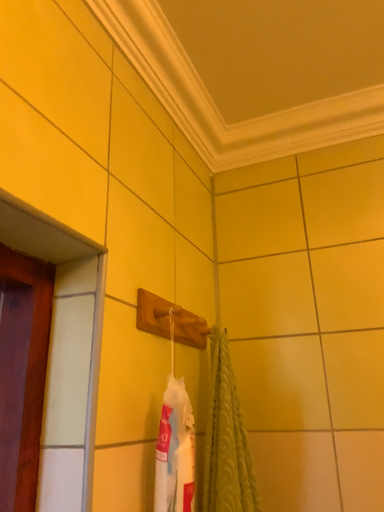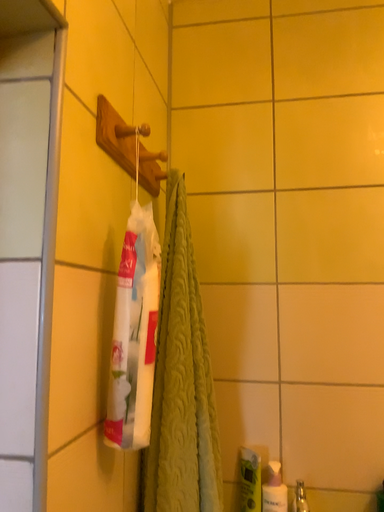
Question: How did the camera likely rotate when shooting the video?

Choices:
 (A) rotated left
 (B) rotated right

Answer: (B)